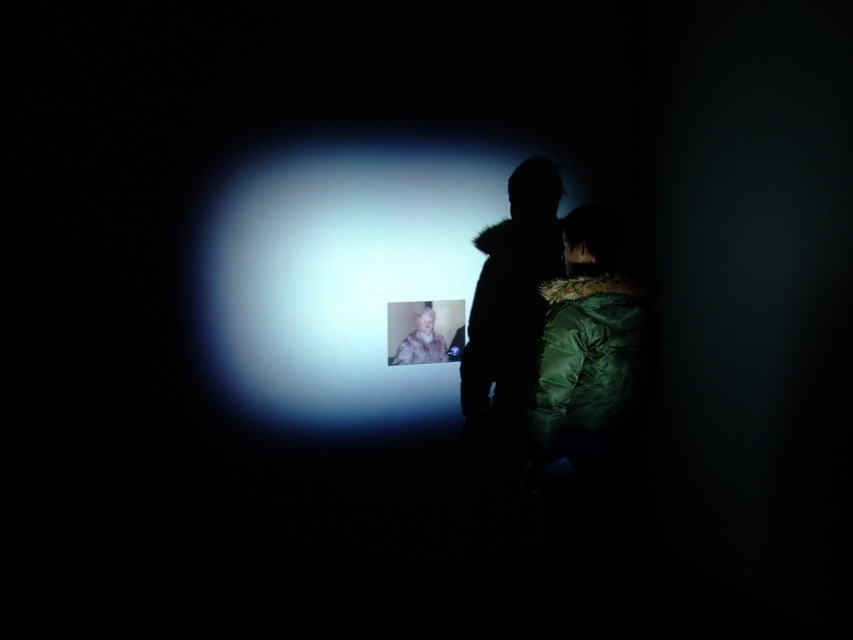
Is point (496, 321) closer to viewer compared to point (433, 358)?

No, it is not.

Can you confirm if green down jacket at center is bigger than white fur coat at center?

Indeed, green down jacket at center has a larger size compared to white fur coat at center.

Image resolution: width=853 pixels, height=640 pixels. I want to click on green down jacket at center, so click(x=511, y=294).

Is dark fur coat at center smaller than green down jacket at center?

Incorrect, dark fur coat at center is not smaller in size than green down jacket at center.

Does point (512, 209) come farther from viewer compared to point (517, 256)?

That is False.

Is point (490, 401) positioned behind point (485, 276)?

Yes, point (490, 401) is behind point (485, 276).

Identify the location of dark fur coat at center. (511, 294).

Does dark fur coat at center have a lesser height compared to white fur coat at center?

No, dark fur coat at center is not shorter than white fur coat at center.

Is dark fur coat at center taller than white fur coat at center?

Correct, dark fur coat at center is much taller as white fur coat at center.

The width and height of the screenshot is (853, 640). What do you see at coordinates (511, 294) in the screenshot?
I see `dark fur coat at center` at bounding box center [511, 294].

Find the location of a particular element. The height and width of the screenshot is (640, 853). dark fur coat at center is located at coordinates (511, 294).